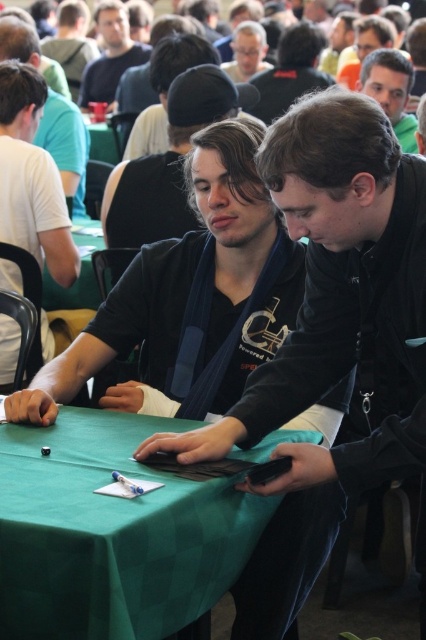
You are organizing a small event and need to place a new decorative item on the table. The table has limited space. Given the current setup with the matte black laptop at center and the white matte shirt at upper left, which object would you choose to move to accommodate the new item?

The white matte shirt at upper left should be moved because it is smaller in size than the matte black laptop at center, making it easier to relocate without disrupting the main setup.

You are standing at the entrance of the event hall and see the green checkered table at center and the green fabric table at upper center. Which table is positioned further to the left?

The green fabric table at upper center is positioned further to the left because the green checkered table at center is to the right of it.